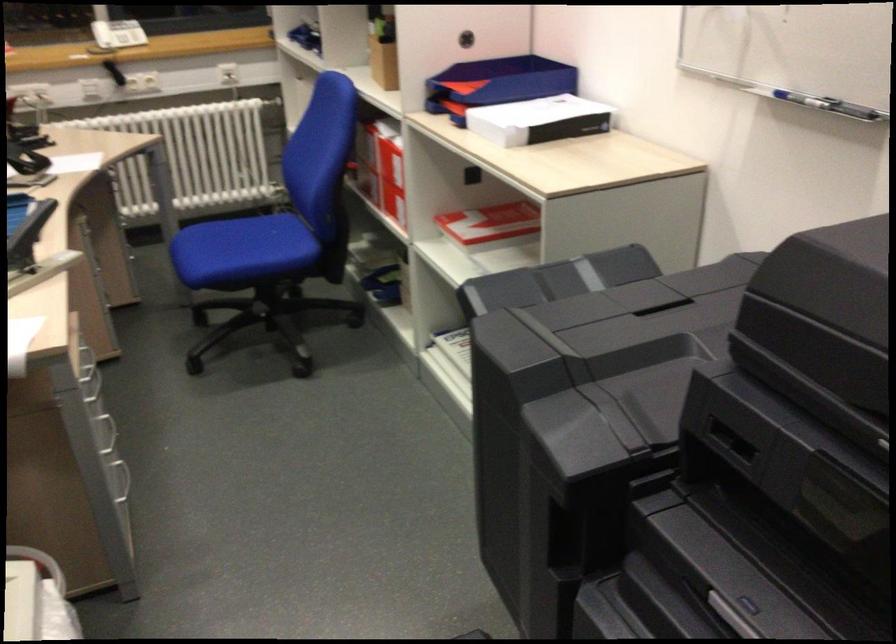
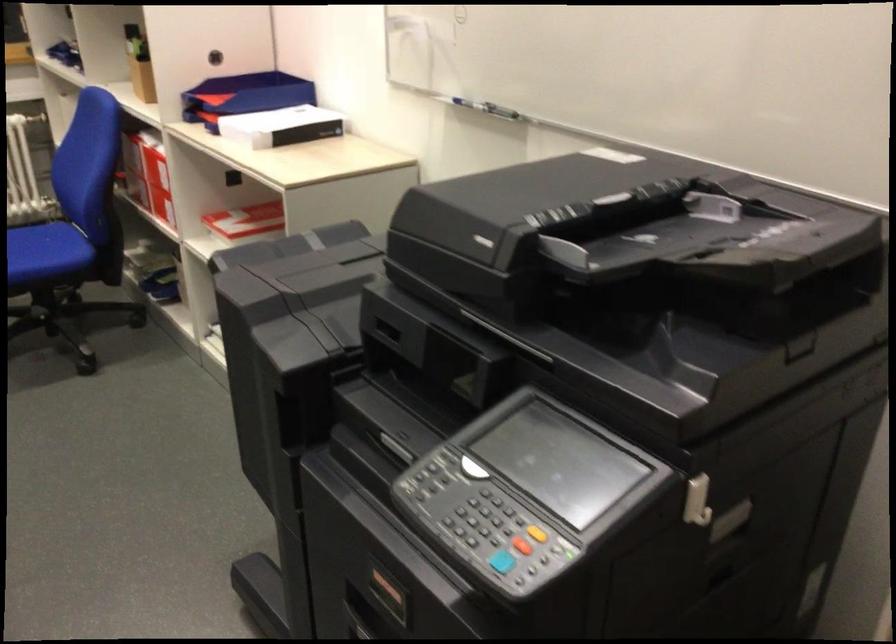
Locate, in the second image, the point that corresponds to point 270,232 in the first image.

(42, 243)